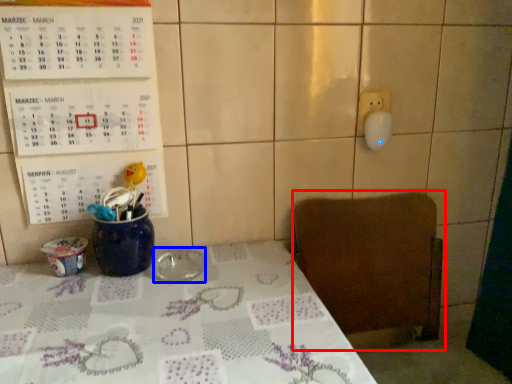
Question: Among these objects, which one is farthest to the camera, chair (highlighted by a red box) or tableware (highlighted by a blue box)?

Choices:
 (A) chair
 (B) tableware

Answer: (B)